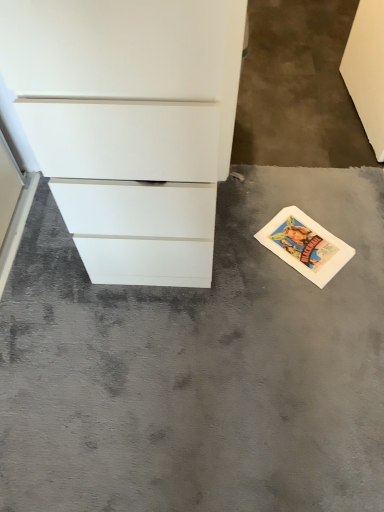
Locate an element on the screen. This screenshot has height=512, width=384. unoccupied space behind white paper postcard at lower right is located at coordinates (301, 200).